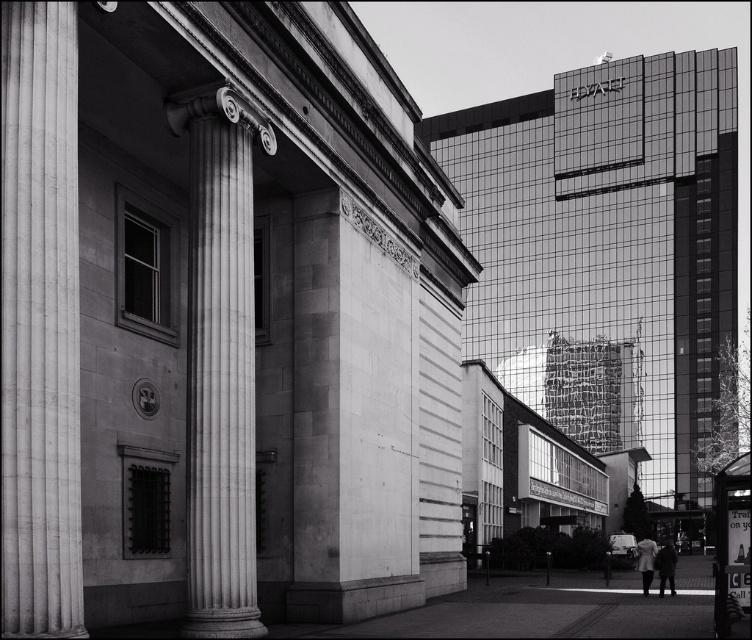
Question: In this image, where is smooth stone column at left located relative to white marble column at center?

Choices:
 (A) left
 (B) right

Answer: (A)

Question: Which point is farther from the camera taking this photo?

Choices:
 (A) (11, 563)
 (B) (226, 104)

Answer: (B)

Question: From the image, what is the correct spatial relationship of smooth stone column at left in relation to white marble column at center?

Choices:
 (A) above
 (B) below

Answer: (A)

Question: Which object appears closest to the camera in this image?

Choices:
 (A) smooth stone column at left
 (B) white marble column at center

Answer: (A)

Question: Can you confirm if smooth stone column at left is wider than white marble column at center?

Choices:
 (A) yes
 (B) no

Answer: (B)